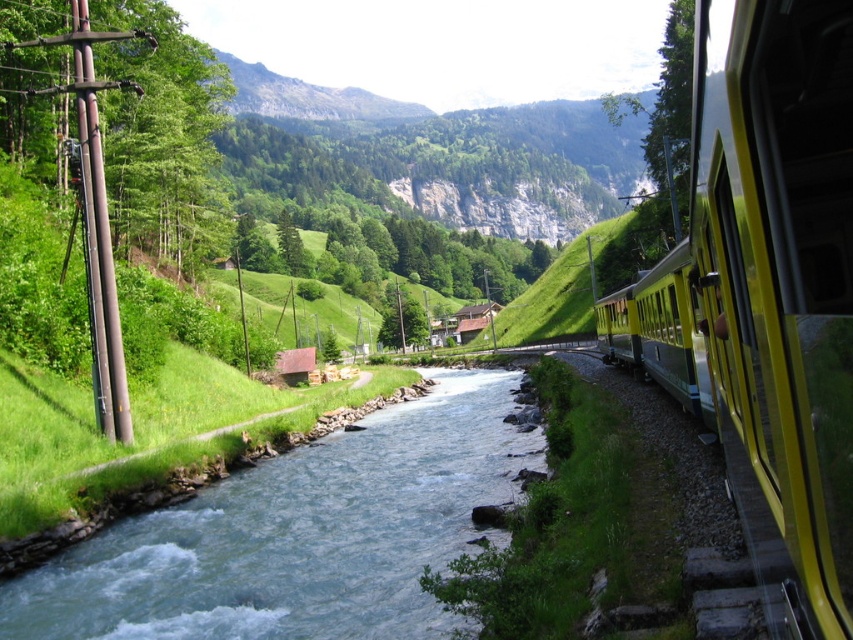
Identify the location of yellow polished metal train at right. tap(778, 289).

Does yellow polished metal train at right have a greater width compared to blue smooth water at center?

Yes.

Where is `yellow polished metal train at right`? This screenshot has width=853, height=640. yellow polished metal train at right is located at coordinates (778, 289).